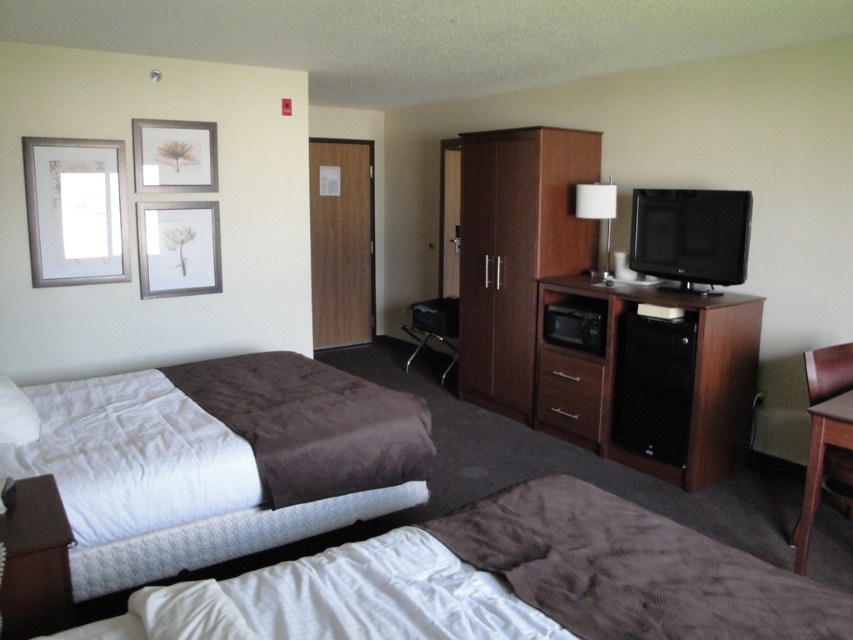
Question: Can you confirm if matte wood picture frame at upper left is positioned to the right of white fabric lampshade at upper right?

Choices:
 (A) yes
 (B) no

Answer: (B)

Question: Can you confirm if silver metallic picture frame at upper left is positioned below brown wood drawer at lower center?

Choices:
 (A) yes
 (B) no

Answer: (B)

Question: Which point is closer to the camera?

Choices:
 (A) (556, 428)
 (B) (614, 205)
 (C) (167, 262)

Answer: (C)

Question: Which point is farther to the camera?

Choices:
 (A) white soft bed at lower left
 (B) matte wood picture frame at upper left
 (C) brown leather table at lower left

Answer: (B)

Question: Can you confirm if brown wood armchair at lower right is bigger than matte silver picture frame at upper left?

Choices:
 (A) no
 (B) yes

Answer: (B)

Question: Estimate the real-world distances between objects in this image. Which object is farther from the silver metallic picture frame at upper left?

Choices:
 (A) brown wood dresser at center right
 (B) velvet brown bed at lower left
 (C) white fabric lampshade at upper right

Answer: (B)